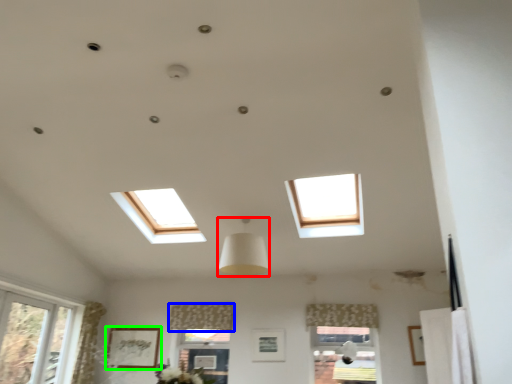
Question: Which object is the farthest from lamp (highlighted by a red box)? Choose among these: curtain (highlighted by a blue box) or picture frame (highlighted by a green box).

Choices:
 (A) curtain
 (B) picture frame

Answer: (B)